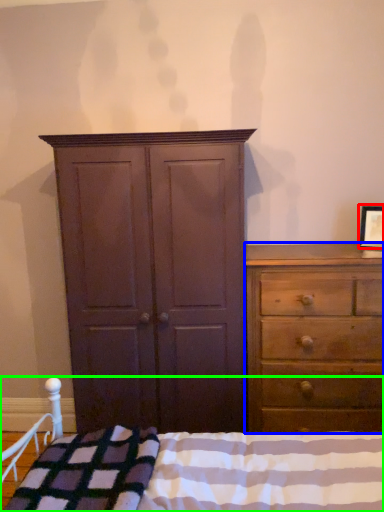
Question: Based on their relative distances, which object is nearer to picture frame (highlighted by a red box)? Choose from chest of drawers (highlighted by a blue box) and bed (highlighted by a green box).

Choices:
 (A) chest of drawers
 (B) bed

Answer: (A)